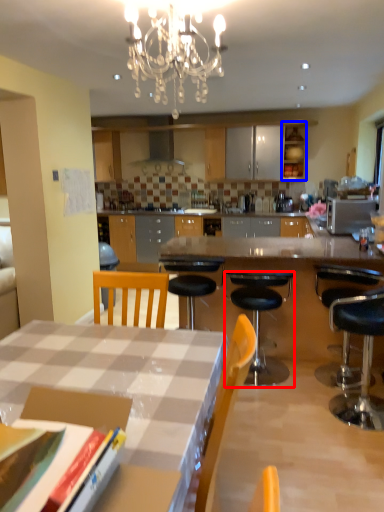
Question: Among these objects, which one is nearest to the camera, chair (highlighted by a red box) or cabinetry (highlighted by a blue box)?

Choices:
 (A) chair
 (B) cabinetry

Answer: (A)